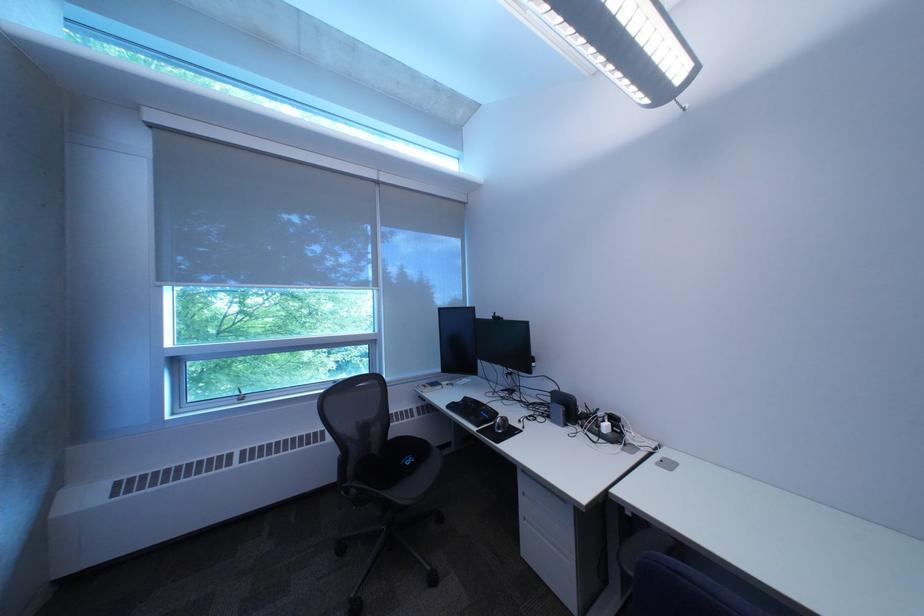
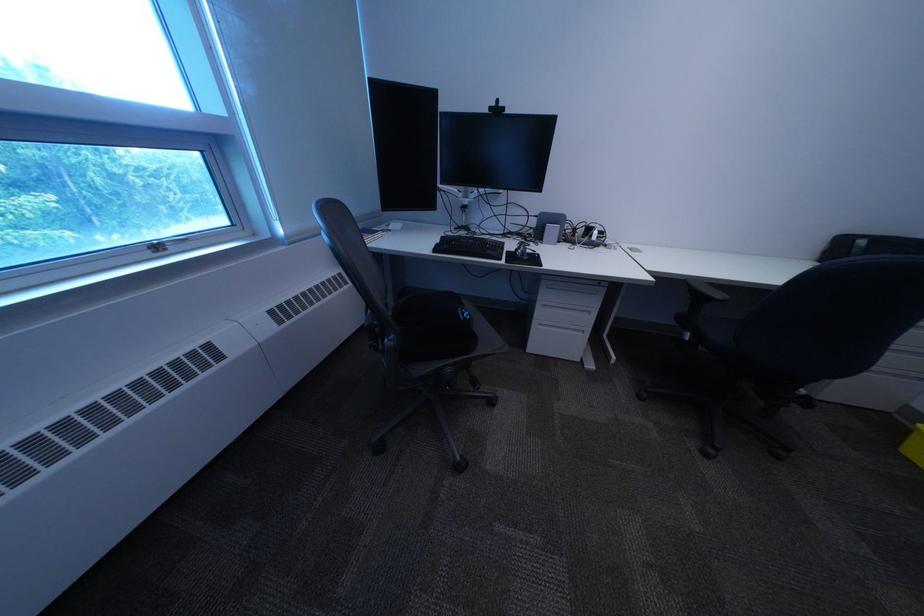
Find the pixel in the second image that matches [540,495] in the first image.

(558, 307)